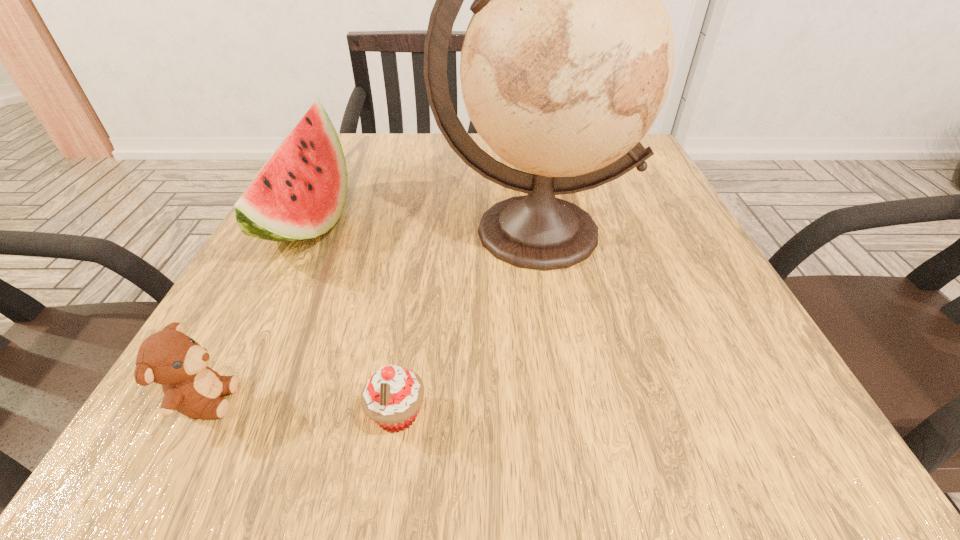
The height and width of the screenshot is (540, 960). I want to click on cupcake located in the near edge section of the desktop, so click(392, 396).

You are a GUI agent. You are given a task and a screenshot of the screen. Output one action in this format:
    pyautogui.click(x=<x>, y=<y>)
    Task: Click on the watermelon that is at the left edge
    Image resolution: width=960 pixels, height=540 pixels.
    Given the screenshot: What is the action you would take?
    pyautogui.click(x=300, y=194)

Find the location of a particular element. teddy bear at the left edge is located at coordinates (x=170, y=358).

At what (x,y) coordinates should I click in order to perform the action: click on object at the right edge. Please return your answer as a coordinate pair (x, y). Looking at the image, I should click on click(x=567, y=61).

This screenshot has width=960, height=540. I want to click on object located at the far left corner, so click(300, 194).

Locate an element on the screen. object that is at the near left corner is located at coordinates (170, 358).

In the image, there is a desktop. At what (x,y) coordinates should I click in order to perform the action: click on free region at the far edge. Please return your answer as a coordinate pair (x, y). The width and height of the screenshot is (960, 540). Looking at the image, I should click on (437, 182).

Locate an element on the screen. The width and height of the screenshot is (960, 540). vacant space at the left edge of the desktop is located at coordinates (311, 319).

This screenshot has height=540, width=960. I want to click on vacant area at the right edge of the desktop, so click(696, 249).

At what (x,y) coordinates should I click in order to perform the action: click on vacant space at the near right corner of the desktop. Please return your answer as a coordinate pair (x, y). The width and height of the screenshot is (960, 540). Looking at the image, I should click on (735, 440).